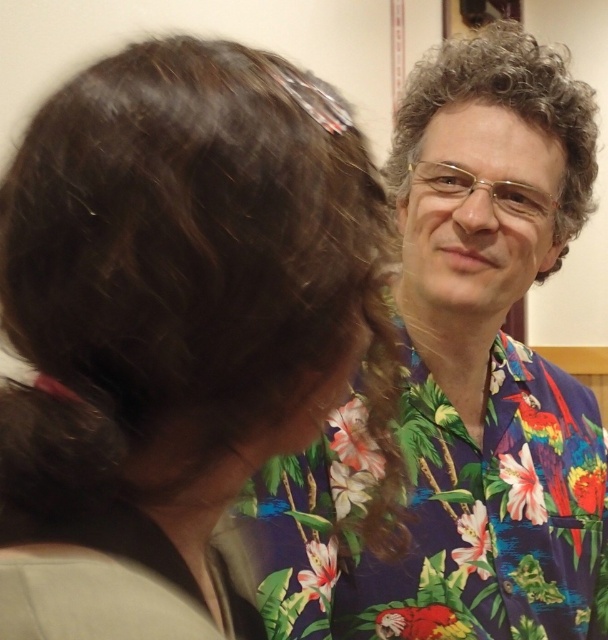
Is dark brown hair at upper left below floral shirt at upper right?

Yes, dark brown hair at upper left is below floral shirt at upper right.

Consider the image. Does dark brown hair at upper left have a smaller size compared to floral shirt at upper right?

Yes.

Is point (395, 456) farther from viewer compared to point (544, 396)?

No, (395, 456) is in front of (544, 396).

You are a GUI agent. You are given a task and a screenshot of the screen. Output one action in this format:
    pyautogui.click(x=<x>, y=<y>)
    Task: Click on the dark brown hair at upper left
    The image size is (608, 640).
    Given the screenshot: What is the action you would take?
    pyautogui.click(x=174, y=326)

Is floral shirt at upper right shorter than curly brown hair at upper right?

Incorrect, floral shirt at upper right's height does not fall short of curly brown hair at upper right's.

Does floral shirt at upper right have a greater width compared to curly brown hair at upper right?

Correct, the width of floral shirt at upper right exceeds that of curly brown hair at upper right.

Locate an element on the screen. Image resolution: width=608 pixels, height=640 pixels. floral shirt at upper right is located at coordinates (460, 385).

Between dark brown hair at upper left and curly brown hair at upper right, which one appears on the left side from the viewer's perspective?

dark brown hair at upper left is more to the left.

Between dark brown hair at upper left and curly brown hair at upper right, which one appears on the right side from the viewer's perspective?

curly brown hair at upper right

Measure the distance between point (44, 232) and camera.

13.18 inches

Locate an element on the screen. This screenshot has height=640, width=608. dark brown hair at upper left is located at coordinates (174, 326).